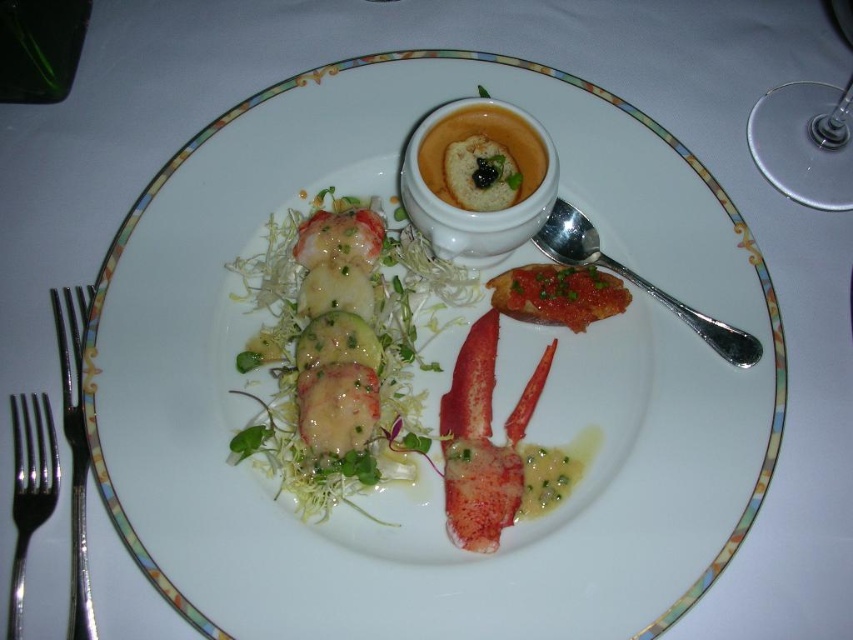
Question: Which point is closer to the camera?

Choices:
 (A) (294, 454)
 (B) (90, 634)
 (C) (838, 19)

Answer: (B)

Question: Which object is farther from the camera taking this photo?

Choices:
 (A) satin silver fork at left
 (B) red glossy lobster tail at center

Answer: (B)

Question: Which of the following is the farthest from the observer?

Choices:
 (A) matte white bowl at center
 (B) satin silver fork at left

Answer: (A)

Question: Does transparent glass at upper right have a greater width compared to satin silver spoon at right?

Choices:
 (A) yes
 (B) no

Answer: (B)

Question: Can you confirm if transparent glass at upper right is positioned to the left of silver metallic fork at left?

Choices:
 (A) yes
 (B) no

Answer: (B)

Question: Does red glossy lobster tail at center come behind satin silver spoon at right?

Choices:
 (A) yes
 (B) no

Answer: (A)